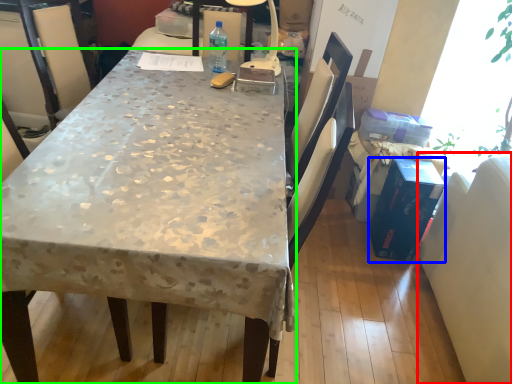
Question: Based on their relative distances, which object is farther from swivel chair (highlighted by a red box)? Choose from box (highlighted by a blue box) and desk (highlighted by a green box).

Choices:
 (A) box
 (B) desk

Answer: (B)